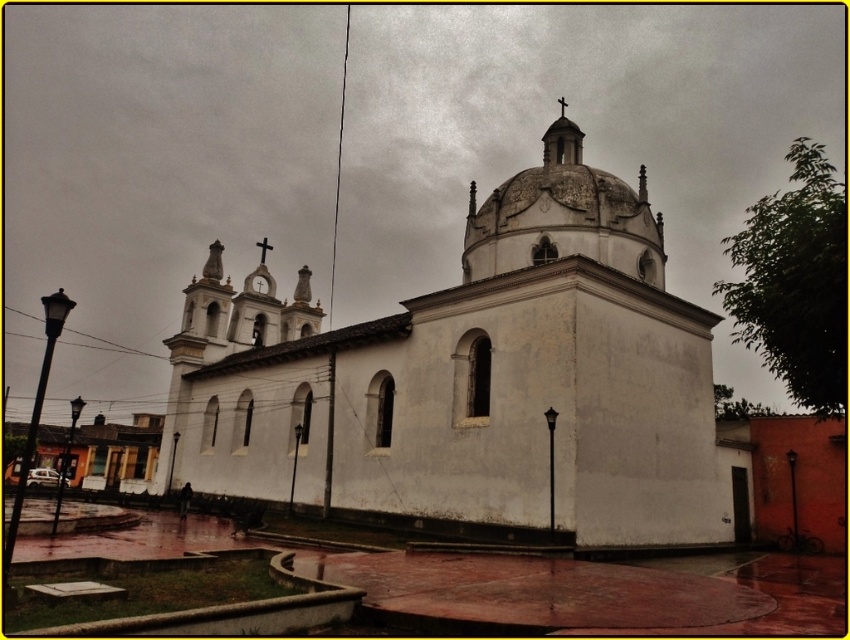
Question: Is white matte church at center closer to the viewer compared to white stone dome at upper center?

Choices:
 (A) no
 (B) yes

Answer: (B)

Question: Where is white matte church at center located in relation to white stone dome at upper center in the image?

Choices:
 (A) above
 (B) below

Answer: (B)

Question: Which object appears closest to the camera in this image?

Choices:
 (A) white stone dome at upper center
 (B) white matte church at center

Answer: (B)

Question: Does white matte church at center have a lesser width compared to white stone dome at upper center?

Choices:
 (A) yes
 (B) no

Answer: (B)

Question: Among these points, which one is nearest to the camera?

Choices:
 (A) (632, 240)
 (B) (310, 417)

Answer: (A)